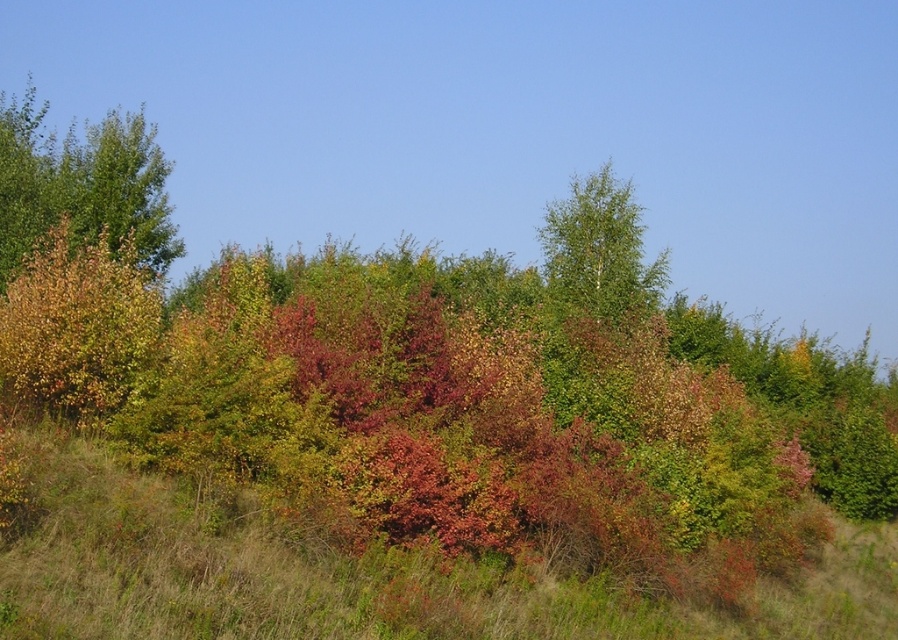
You are standing in the autumnal landscape and want to walk from the point closer to you to the farther point. Which path would you take between point (858, 556) and point (31, 163)?

The path from point (858, 556) to point (31, 163) would involve moving away from the viewer since point (858, 556) is closer to you than point (31, 163).

You are standing in the autumnal landscape and want to locate the green leafy tree at upper left. According to the image coordinates, where exactly is it positioned?

The green leafy tree at upper left is positioned at the 2D coordinates point (82,184).

You are standing in the autumnal landscape and want to place a small flag at the point that is closer to you. Which point should you choose between point (89, 196) and point (562, 292)?

Point (89, 196) is closer to the camera than point (562, 292), so you should choose point (89, 196) to place the small flag.